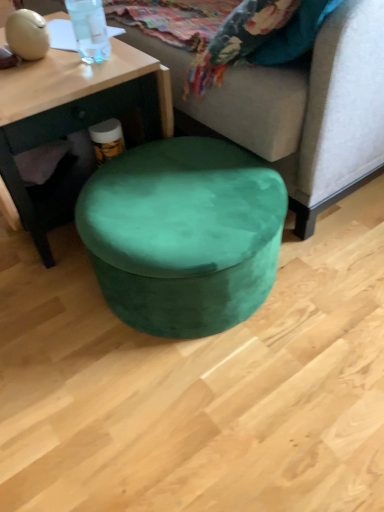
Where is `vacant space in front of velvet green ottoman at center`? This screenshot has height=512, width=384. vacant space in front of velvet green ottoman at center is located at coordinates (200, 411).